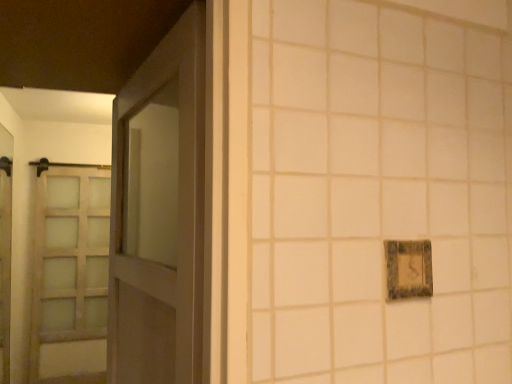
Question: In terms of size, does matte glass elevator at left appear bigger or smaller than rustic stone picture frame at right?

Choices:
 (A) small
 (B) big

Answer: (B)

Question: Considering the positions of point (2, 168) and point (414, 269), is point (2, 168) closer or farther from the camera than point (414, 269)?

Choices:
 (A) closer
 (B) farther

Answer: (B)

Question: Which of these objects is positioned closest to the satin wood barn door at left?

Choices:
 (A) rustic stone picture frame at right
 (B) matte wood door at left
 (C) matte glass elevator at left

Answer: (C)

Question: Which of these objects is positioned farthest from the rustic stone picture frame at right?

Choices:
 (A) matte wood door at left
 (B) matte glass elevator at left
 (C) satin wood barn door at left

Answer: (B)